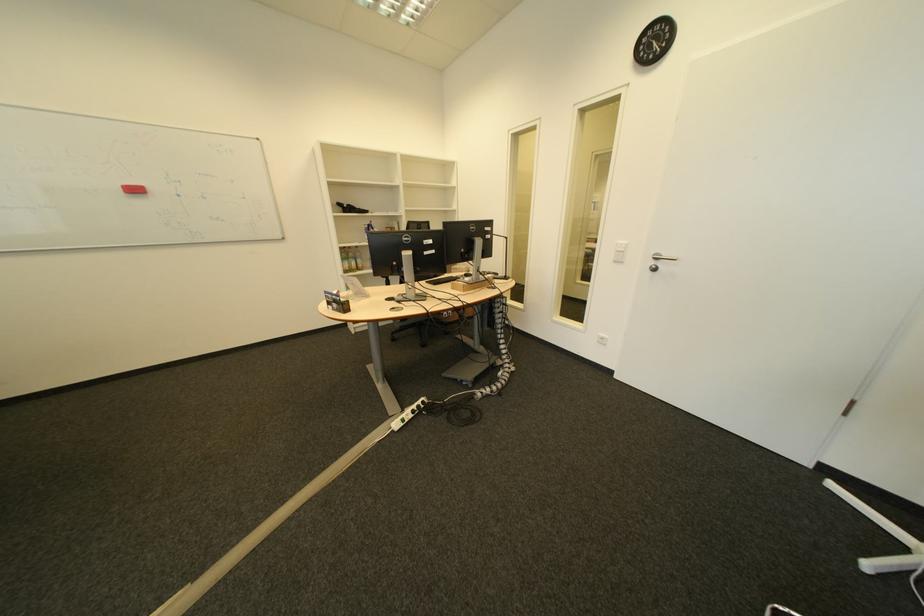
You are a GUI agent. You are given a task and a screenshot of the screen. Output one action in this format:
    pyautogui.click(x=<x>, y=<y>)
    Task: Click on the metal door handle
    
    Given the screenshot: What is the action you would take?
    pyautogui.click(x=659, y=261)